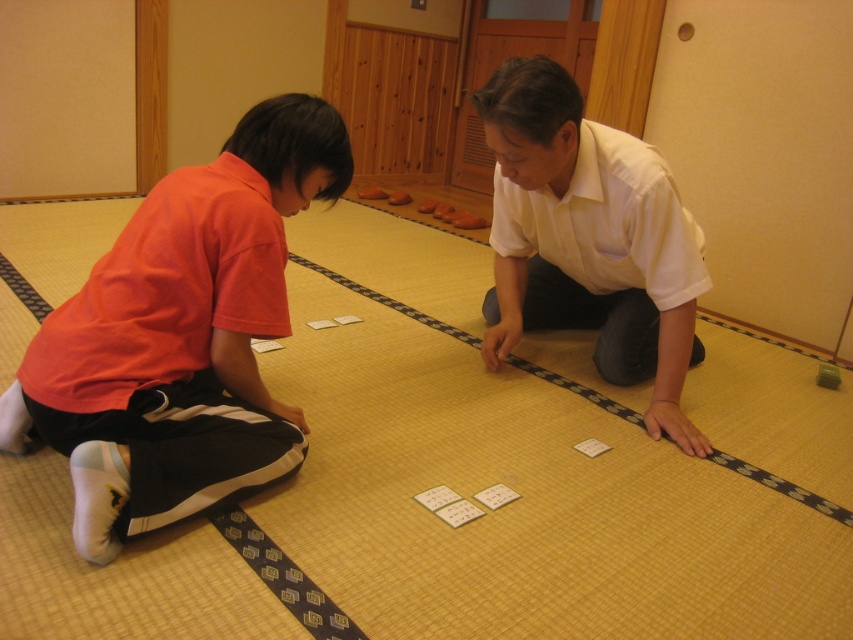
You are a tailor measuring shirts for alterations. You have two shirts in front of you on the tatami mat floor, the orange fabric shirt at left and the white matte shirt at center. Which shirt has a smaller width that might require adjustments for a better fit?

The orange fabric shirt at left has a lesser width compared to the white matte shirt at center, so it might require adjustments for a better fit.

You are a photographer positioned in front of the two individuals playing cards. You want to take a photo that clearly shows both the orange fabric shirt at left and the white matte shirt at center. Which shirt should you adjust your focus on to ensure both are in sharp focus?

The orange fabric shirt at left is closer to the viewer than the white matte shirt at center. To ensure both are in sharp focus, adjust your focus on the white matte shirt at center since it is farther away, allowing the depth of field to cover both distances.